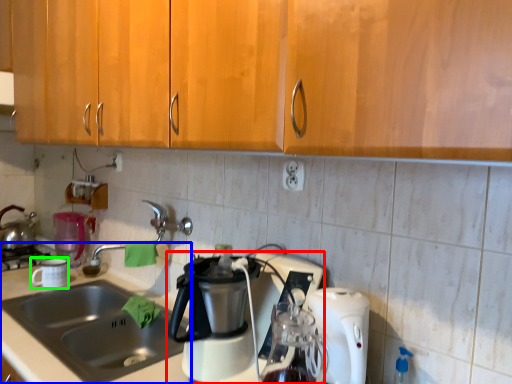
Question: Which object is positioned farthest from coffee maker (highlighted by a red box)? Select from sink (highlighted by a blue box) and coffee cup (highlighted by a green box).

Choices:
 (A) sink
 (B) coffee cup

Answer: (B)